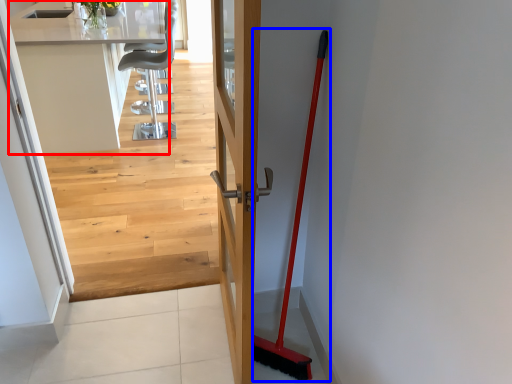
Question: Among these objects, which one is nearest to the camera, counter top (highlighted by a red box) or shovel (highlighted by a blue box)?

Choices:
 (A) counter top
 (B) shovel

Answer: (B)